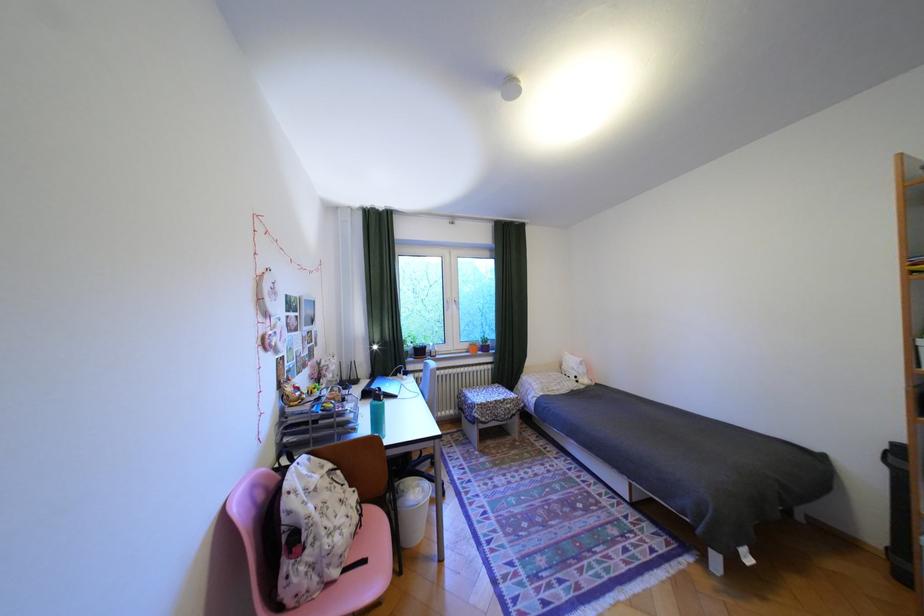
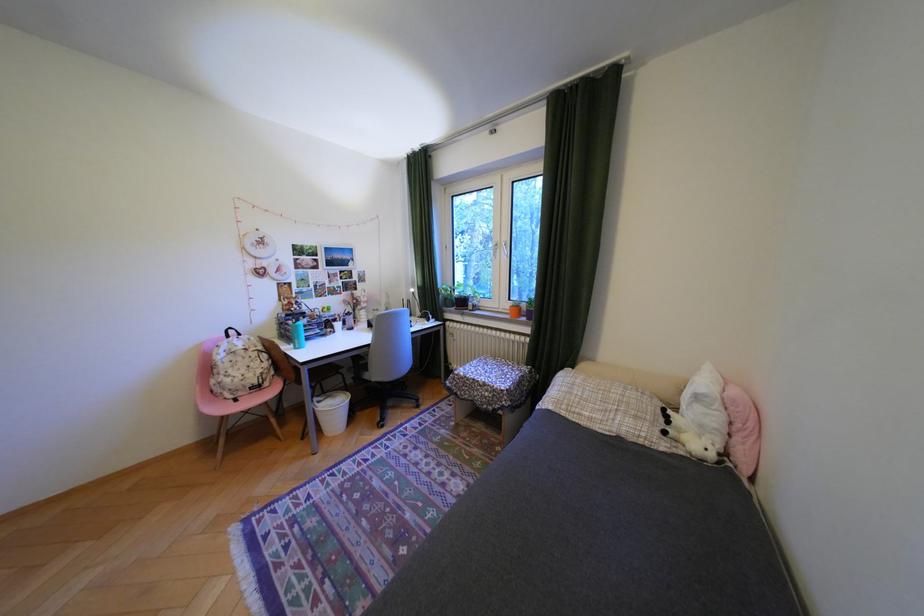
In the second image, find the point that corresponds to (589,382) in the first image.

(676, 432)